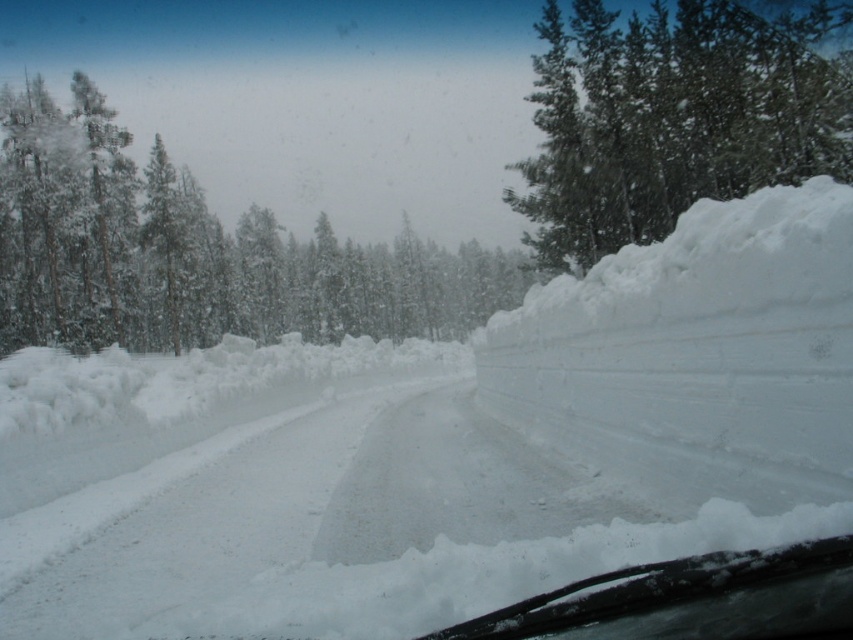
Can you confirm if white frosty trees at upper center is bigger than green textured snow at upper right?

No.

Who is taller, white frosty trees at upper center or green textured snow at upper right?

green textured snow at upper right is taller.

Is point (3, 138) positioned before point (708, 60)?

That is False.

Where is `white frosty trees at upper center`? white frosty trees at upper center is located at coordinates (195, 252).

Does white fluffy snow at center have a lesser height compared to clear glass windshield at lower center?

No.

Is white fluffy snow at center bigger than clear glass windshield at lower center?

Correct, white fluffy snow at center is larger in size than clear glass windshield at lower center.

Which is in front, point (717, 400) or point (817, 580)?

Point (817, 580) is more forward.

Locate an element on the screen. white fluffy snow at center is located at coordinates (440, 445).

Can you confirm if green textured snow at upper right is positioned to the left of clear glass windshield at lower center?

No, green textured snow at upper right is not to the left of clear glass windshield at lower center.

Is green textured snow at upper right smaller than clear glass windshield at lower center?

Actually, green textured snow at upper right might be larger than clear glass windshield at lower center.

Find the location of `green textured snow at upper right`. green textured snow at upper right is located at coordinates (672, 118).